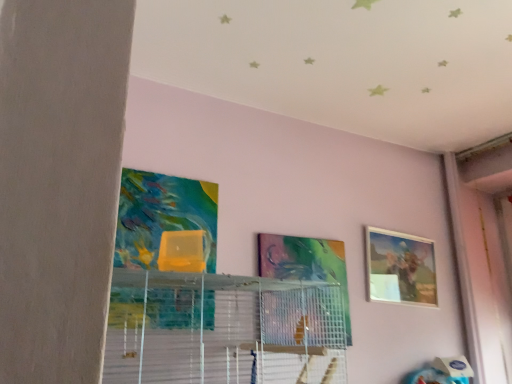
Question: Which direction should I rotate to face metallic silver picture frame at center, which appears as the second picture frame when viewed from the right, — up or down?

Choices:
 (A) down
 (B) up

Answer: (A)

Question: Is matte wooden picture frame at upper right, which appears as the 1th picture frame when viewed from the back, not near metallic silver picture frame at center, which is the first picture frame from front to back?

Choices:
 (A) yes
 (B) no

Answer: (B)

Question: Is matte wooden picture frame at upper right, which appears as the 1th picture frame when viewed from the back, placed right next to metallic silver picture frame at center, which appears as the 2th picture frame when viewed from the back?

Choices:
 (A) no
 (B) yes

Answer: (A)

Question: Is matte wooden picture frame at upper right, marked as the second picture frame in a left-to-right arrangement, aimed at metallic silver picture frame at center, which is the first picture frame from front to back?

Choices:
 (A) no
 (B) yes

Answer: (A)

Question: Is matte wooden picture frame at upper right, which ranks as the second picture frame in front-to-back order, at the left side of metallic silver picture frame at center, which is the first picture frame from front to back?

Choices:
 (A) yes
 (B) no

Answer: (B)

Question: Considering the relative sizes of matte wooden picture frame at upper right, which ranks as the second picture frame in front-to-back order, and metallic silver picture frame at center, which appears as the second picture frame when viewed from the right, in the image provided, is matte wooden picture frame at upper right, which ranks as the second picture frame in front-to-back order, bigger than metallic silver picture frame at center, which appears as the second picture frame when viewed from the right,?

Choices:
 (A) yes
 (B) no

Answer: (A)

Question: Is matte wooden picture frame at upper right, marked as the second picture frame in a left-to-right arrangement, positioned before metallic silver picture frame at center, which is the first picture frame from front to back?

Choices:
 (A) yes
 (B) no

Answer: (B)

Question: Does metallic silver picture frame at center, which is the first picture frame from front to back, have a greater height compared to clear plastic shelf at center?

Choices:
 (A) yes
 (B) no

Answer: (A)

Question: Would you say metallic silver picture frame at center, which is the first picture frame from front to back, is outside clear plastic shelf at center?

Choices:
 (A) yes
 (B) no

Answer: (A)

Question: From the image's perspective, is metallic silver picture frame at center, which appears as the second picture frame when viewed from the right, on clear plastic shelf at center?

Choices:
 (A) yes
 (B) no

Answer: (A)

Question: Is metallic silver picture frame at center, which appears as the second picture frame when viewed from the right, oriented away from clear plastic shelf at center?

Choices:
 (A) yes
 (B) no

Answer: (B)

Question: Can clear plastic shelf at center be found inside metallic silver picture frame at center, which appears as the 2th picture frame when viewed from the back?

Choices:
 (A) no
 (B) yes

Answer: (A)

Question: Does metallic silver picture frame at center, which is the first picture frame from front to back, turn towards clear plastic shelf at center?

Choices:
 (A) yes
 (B) no

Answer: (B)

Question: Does clear plastic shelf at center come in front of matte wooden picture frame at upper right, which appears as the 1th picture frame when viewed from the back?

Choices:
 (A) yes
 (B) no

Answer: (A)